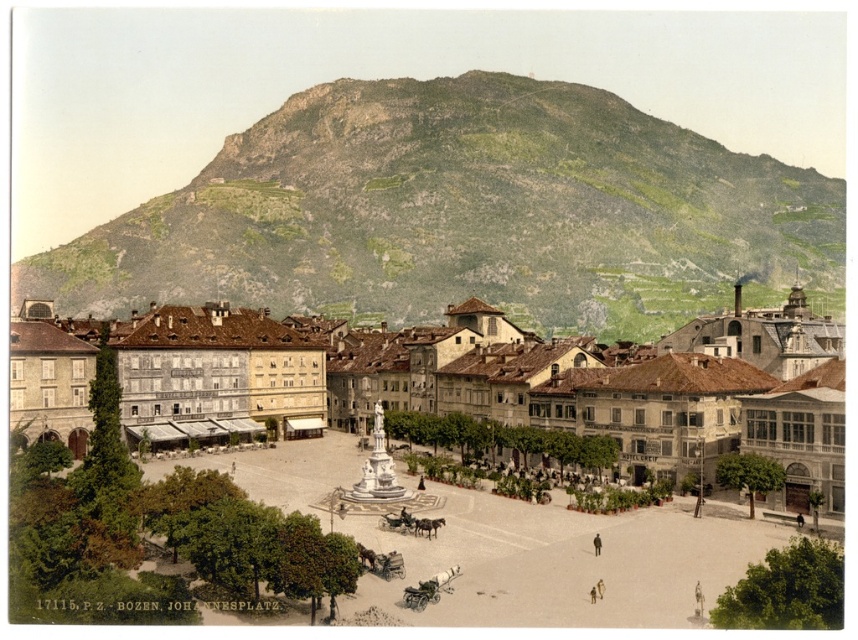
You are a visitor in the town square and want to know which object is taller between the matte stone fountain at center and the dark brown coat at center. Which one is taller?

The matte stone fountain at center is much taller than the dark brown coat at center.

You are standing in the town square and want to take a photo of the green grassy mountain at upper center. Which direction should you face to capture it in your viewfinder?

The green grassy mountain at upper center is located at point (464,212), which is in the upper center of the image. To capture it, you should face towards the upper center direction, likely looking towards the mountain backdrop behind the square.

You are a tourist in the town square and you see the dark brown coat at center and the green grassy mountain at upper center. Which object is closer to you?

The dark brown coat at center is behind the green grassy mountain at upper center, so the green grassy mountain at upper center is closer to you.